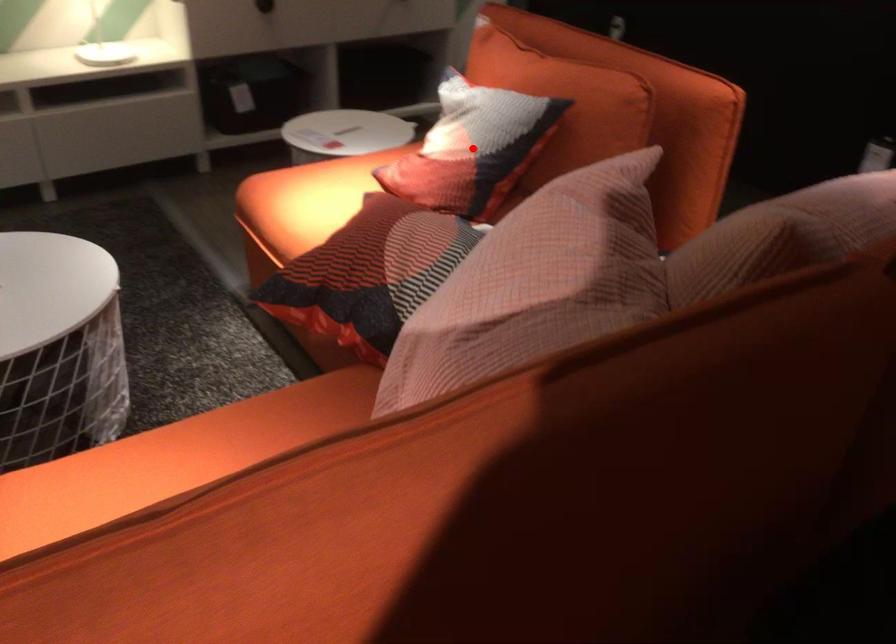
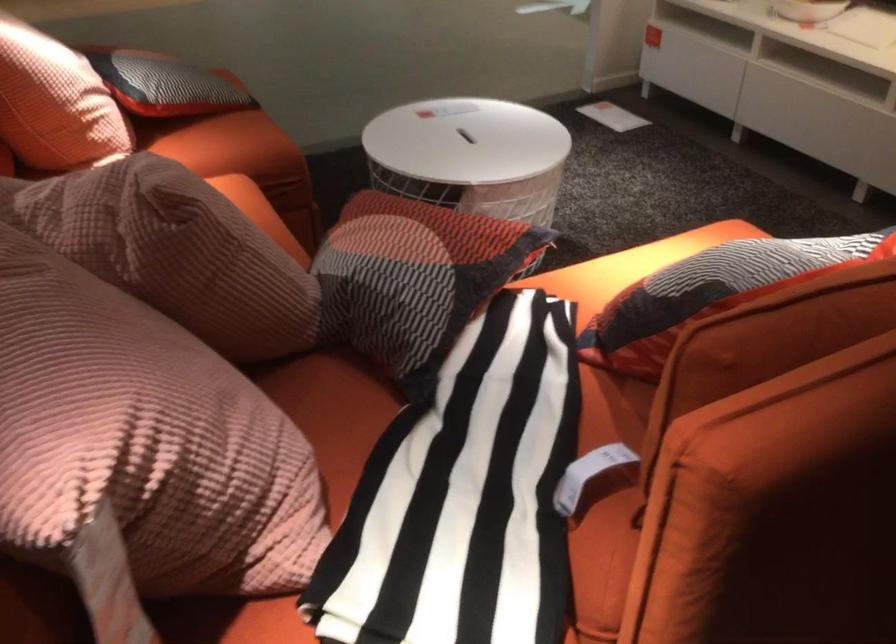
Question: I am providing you with two images of the same scene from different viewpoints. A red point is marked on the first image. Is the red point's position out of view in image 2?

Choices:
 (A) Yes
 (B) No

Answer: (A)